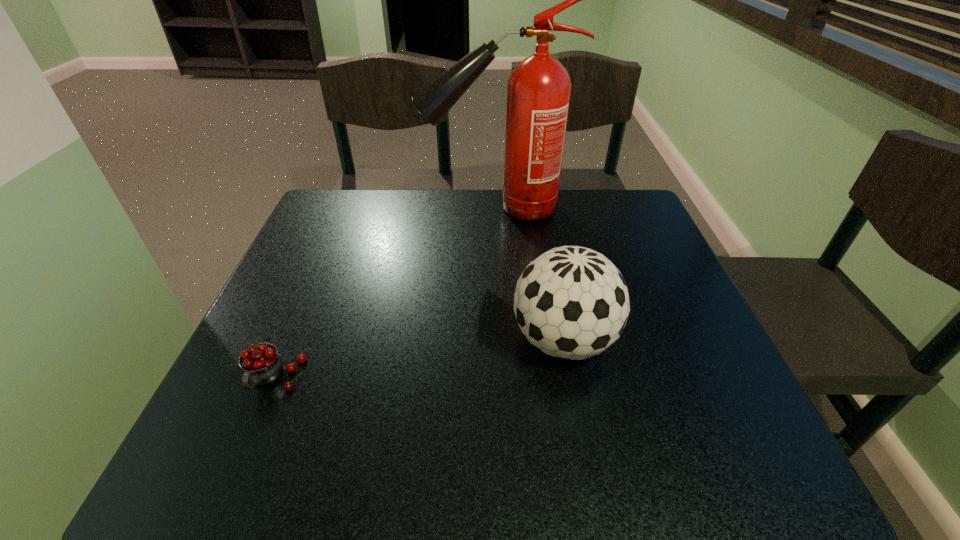
At what (x,y) coordinates should I click in order to perform the action: click on object located in the far edge section of the desktop. Please return your answer as a coordinate pair (x, y). Looking at the image, I should click on (538, 90).

Where is `object at the left edge`? This screenshot has height=540, width=960. object at the left edge is located at coordinates (x=262, y=364).

What are the coordinates of `vacant point at the far edge` in the screenshot? It's located at (413, 207).

The image size is (960, 540). What are the coordinates of `free space at the near edge of the desktop` in the screenshot? It's located at (348, 451).

This screenshot has height=540, width=960. Find the location of `vacant area at the left edge of the desktop`. vacant area at the left edge of the desktop is located at coordinates (299, 390).

Where is `free region at the right edge`? free region at the right edge is located at coordinates (714, 389).

Where is `vacant space at the near left corner of the desktop`? The height and width of the screenshot is (540, 960). vacant space at the near left corner of the desktop is located at coordinates (x=268, y=450).

The width and height of the screenshot is (960, 540). I want to click on vacant region at the far right corner of the desktop, so click(x=602, y=201).

Locate an element on the screen. vacant space at the near right corner of the desktop is located at coordinates (744, 438).

At what (x,y) coordinates should I click in order to perform the action: click on blank region between the soccer ball and the shortest object. Please return your answer as a coordinate pair (x, y). This screenshot has height=540, width=960. Looking at the image, I should click on (419, 360).